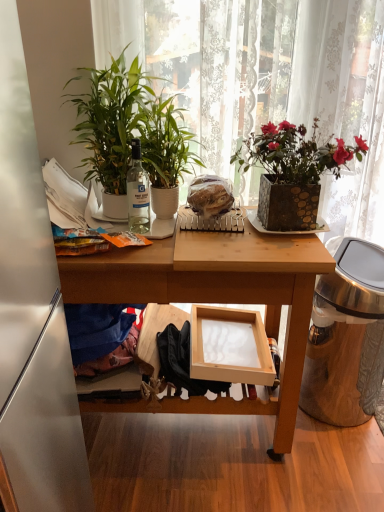
Question: Can you confirm if wooden frame at lower center is thinner than translucent plastic bread at center?

Choices:
 (A) yes
 (B) no

Answer: (B)

Question: Is the position of wooden frame at lower center more distant than that of translucent plastic bread at center?

Choices:
 (A) no
 (B) yes

Answer: (B)

Question: Can you confirm if wooden frame at lower center is positioned to the left of translucent plastic bread at center?

Choices:
 (A) no
 (B) yes

Answer: (A)

Question: Does wooden frame at lower center have a greater width compared to translucent plastic bread at center?

Choices:
 (A) yes
 (B) no

Answer: (A)

Question: From the image's perspective, is wooden frame at lower center beneath translucent plastic bread at center?

Choices:
 (A) no
 (B) yes

Answer: (B)

Question: Considering the positions of white matte refrigerator at left and wooden frame at lower center in the image, is white matte refrigerator at left wider or thinner than wooden frame at lower center?

Choices:
 (A) thin
 (B) wide

Answer: (A)

Question: Looking at the image, does white matte refrigerator at left seem bigger or smaller compared to wooden frame at lower center?

Choices:
 (A) big
 (B) small

Answer: (A)

Question: From their relative heights in the image, would you say white matte refrigerator at left is taller or shorter than wooden frame at lower center?

Choices:
 (A) short
 (B) tall

Answer: (B)

Question: Would you say white matte refrigerator at left is to the left or to the right of wooden frame at lower center in the picture?

Choices:
 (A) right
 (B) left

Answer: (B)

Question: Would you say white matte refrigerator at left is inside or outside blue cotton clothing at lower left?

Choices:
 (A) inside
 (B) outside

Answer: (B)

Question: Is white matte refrigerator at left to the left or to the right of blue cotton clothing at lower left in the image?

Choices:
 (A) right
 (B) left

Answer: (A)

Question: Relative to blue cotton clothing at lower left, is white matte refrigerator at left in front or behind?

Choices:
 (A) front
 (B) behind

Answer: (A)

Question: From a real-world perspective, is white matte refrigerator at left above or below blue cotton clothing at lower left?

Choices:
 (A) below
 (B) above

Answer: (B)

Question: Considering the positions of white matte refrigerator at left and white lace curtain at upper center in the image, is white matte refrigerator at left bigger or smaller than white lace curtain at upper center?

Choices:
 (A) big
 (B) small

Answer: (B)

Question: From a real-world perspective, is white matte refrigerator at left physically located above or below white lace curtain at upper center?

Choices:
 (A) above
 (B) below

Answer: (B)